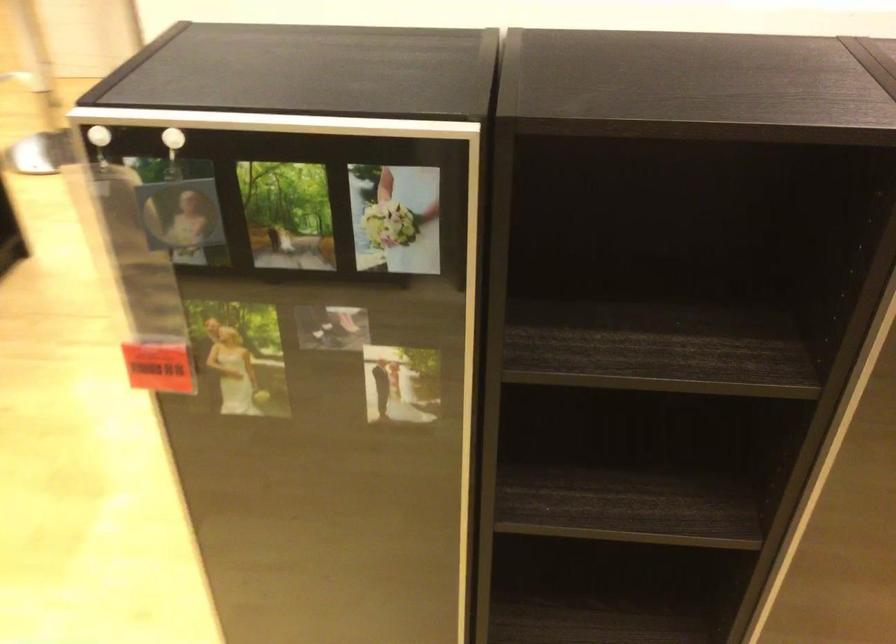
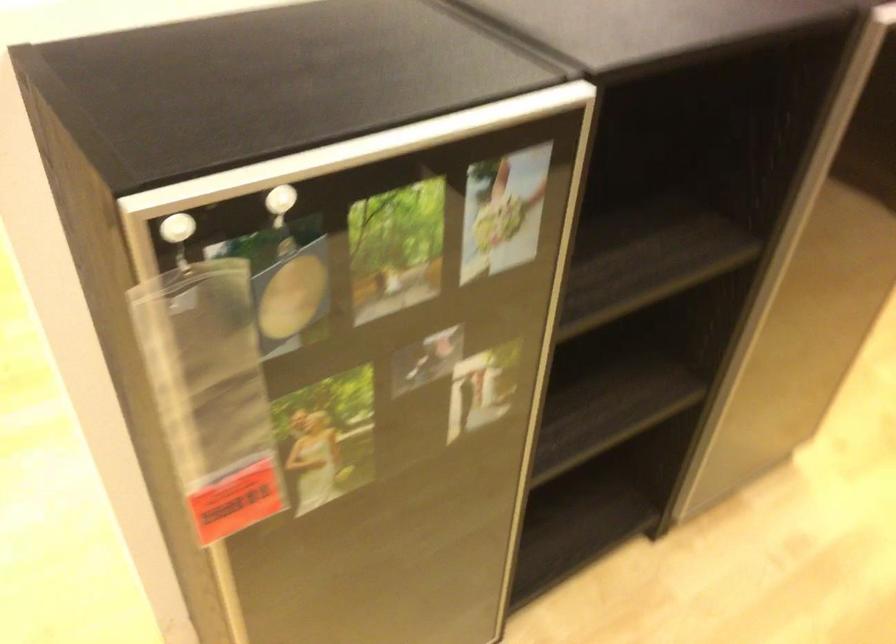
Question: The camera is either moving clockwise (left) or counter-clockwise (right) around the object. The first image is from the beginning of the video and the second image is from the end. Is the camera moving left or right when shooting the video?

Choices:
 (A) Left
 (B) Right

Answer: (A)